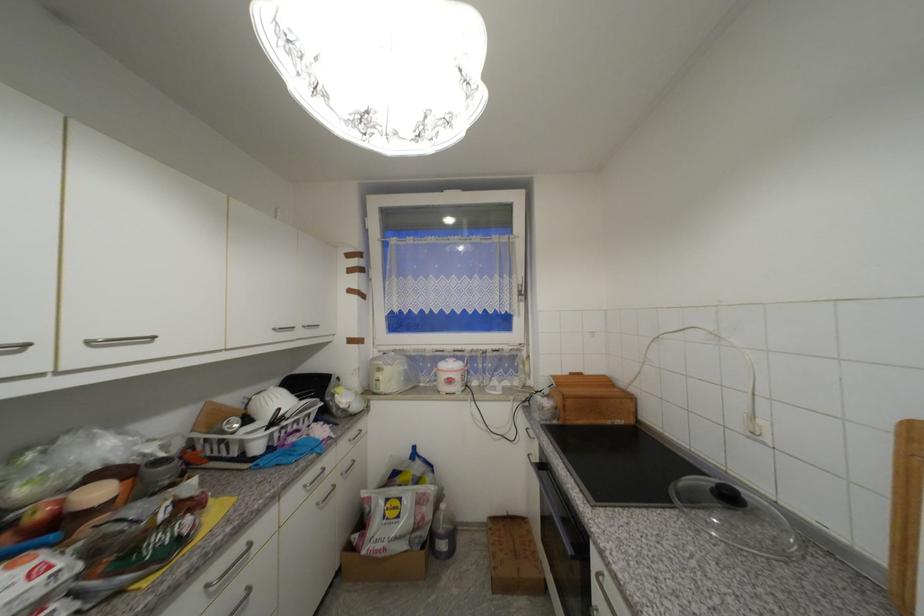
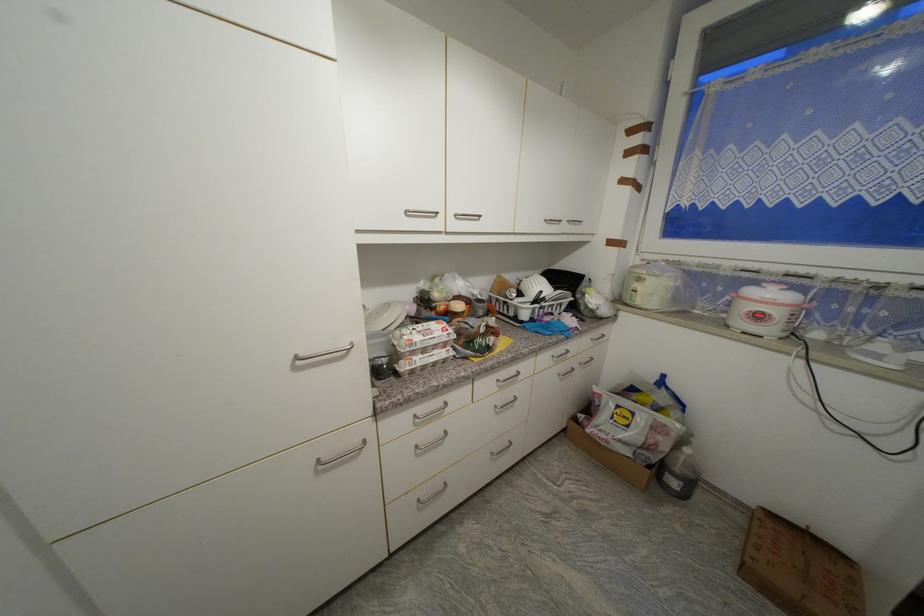
First-person continuous shooting, in which direction is the camera rotating?

The camera's rotation is toward left-down.